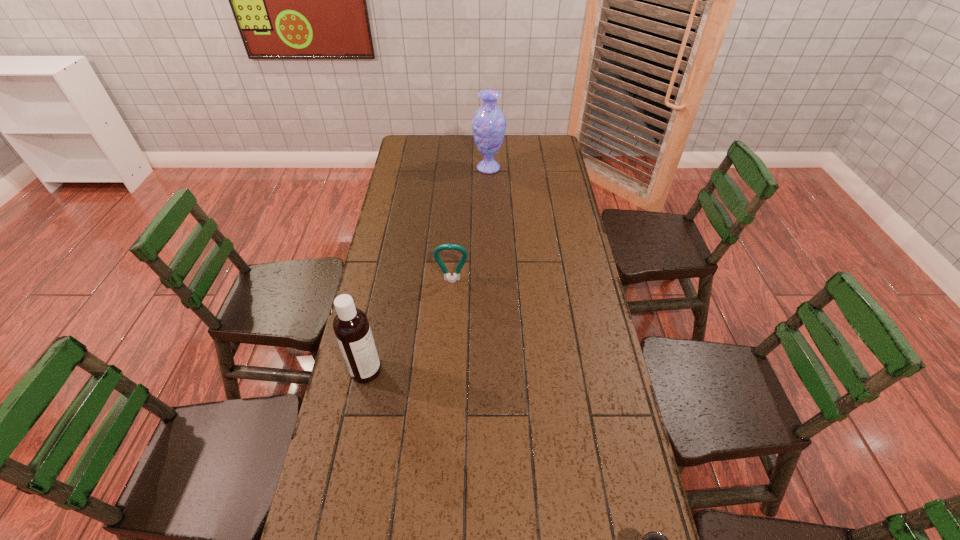
In order to click on object present at the left edge in this screenshot , I will do `click(351, 327)`.

In the image, there is a desktop. Identify the location of vacant area at the far edge. (441, 138).

This screenshot has height=540, width=960. In the image, there is a desktop. What are the coordinates of `vacant space at the left edge` in the screenshot? It's located at (417, 174).

Where is `vacant space at the right edge`? The width and height of the screenshot is (960, 540). vacant space at the right edge is located at coordinates (585, 309).

In the image, there is a desktop. At what (x,y) coordinates should I click in order to perform the action: click on vacant area at the far right corner. Please return your answer as a coordinate pair (x, y). The height and width of the screenshot is (540, 960). Looking at the image, I should click on (538, 145).

Locate an element on the screen. The height and width of the screenshot is (540, 960). free area in between the second shortest object and the second object from right to left is located at coordinates (470, 224).

Find the location of a particular element. The width and height of the screenshot is (960, 540). unoccupied area between the farthest object and the third tallest object is located at coordinates (470, 224).

The image size is (960, 540). Find the location of `free spot between the farthest object and the bottle opener`. free spot between the farthest object and the bottle opener is located at coordinates (470, 224).

Where is `vacant area that lies between the vase and the dishwasher detergent`? The width and height of the screenshot is (960, 540). vacant area that lies between the vase and the dishwasher detergent is located at coordinates (427, 269).

Locate an element on the screen. This screenshot has height=540, width=960. vacant space that is in between the second farthest object and the farthest object is located at coordinates (470, 224).